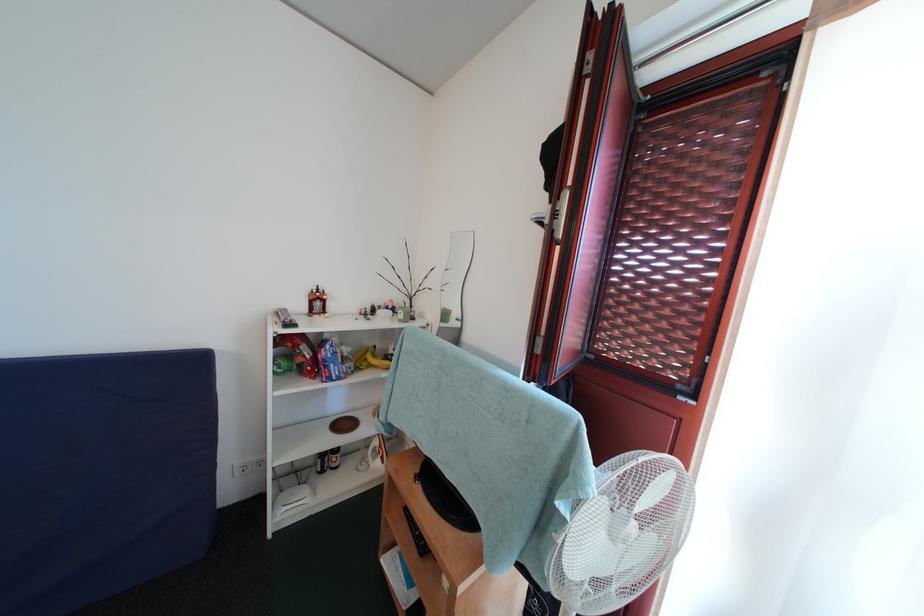
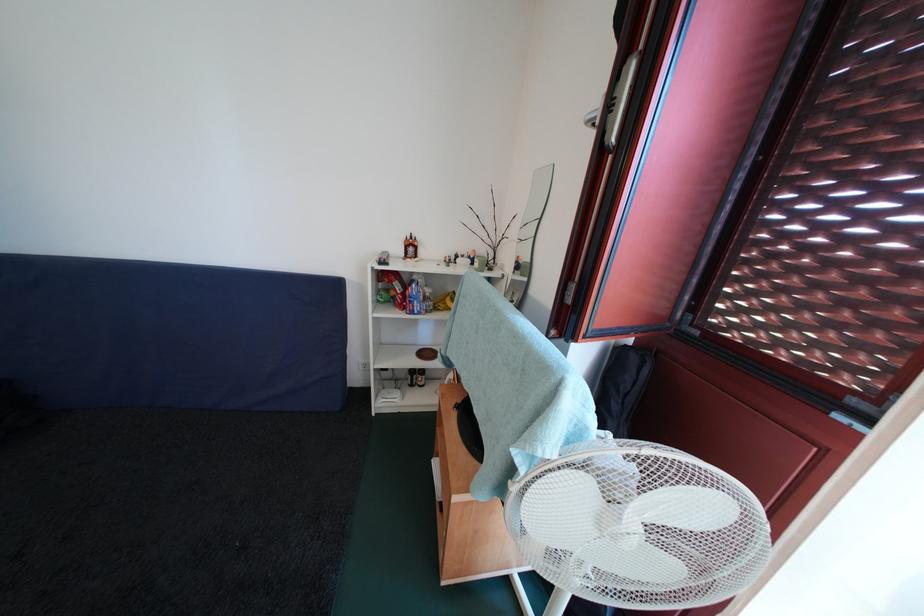
Question: How did the camera likely rotate?

Choices:
 (A) Left
 (B) Right
 (C) Up
 (D) Down

Answer: (A)